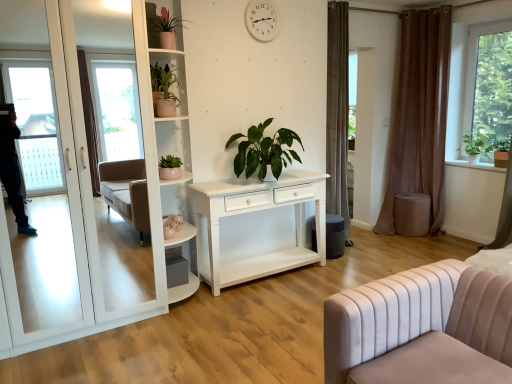
Locate an element on the screen. This screenshot has width=512, height=384. free location in front of velvet beige stool at right is located at coordinates (425, 242).